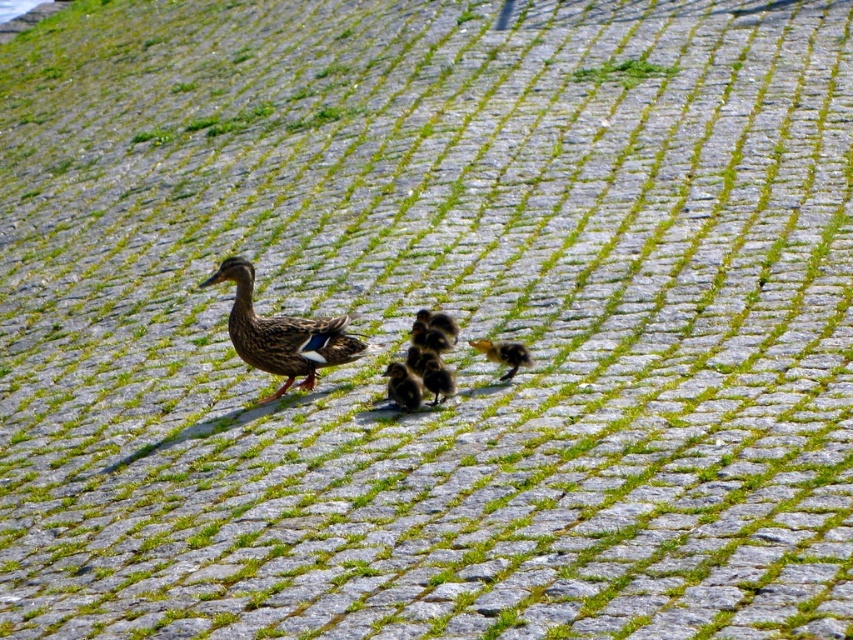
Question: Which object appears closest to the camera in this image?

Choices:
 (A) brown feathered duckling at center
 (B) yellow fuzzy duckling at center
 (C) brown fluffy duckling at center
 (D) brown fuzzy duckling at center

Answer: (C)

Question: Can you confirm if brown fluffy duckling at center is thinner than brown fuzzy duckling at center?

Choices:
 (A) yes
 (B) no

Answer: (A)

Question: Which point is closer to the camera?

Choices:
 (A) brown feathered duckling at center
 (B) brown fuzzy duckling at center

Answer: (A)

Question: Can you confirm if brown feathered duckling at center is positioned above soft yellow duckling at center?

Choices:
 (A) yes
 (B) no

Answer: (A)

Question: Where is soft yellow duckling at center located in relation to yellow fuzzy duckling at center in the image?

Choices:
 (A) left
 (B) right

Answer: (A)

Question: Which point is closer to the camera?

Choices:
 (A) brown fuzzy duckling at center
 (B) soft yellow duckling at center
 (C) brown feathered duckling at center

Answer: (B)